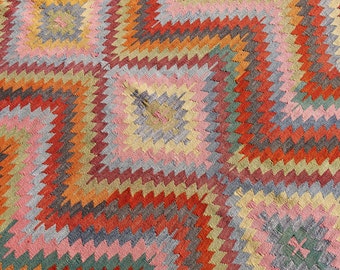
Identify the location of pink yarn used to make rug or blanket. (253, 212), (131, 151), (26, 165), (296, 110).